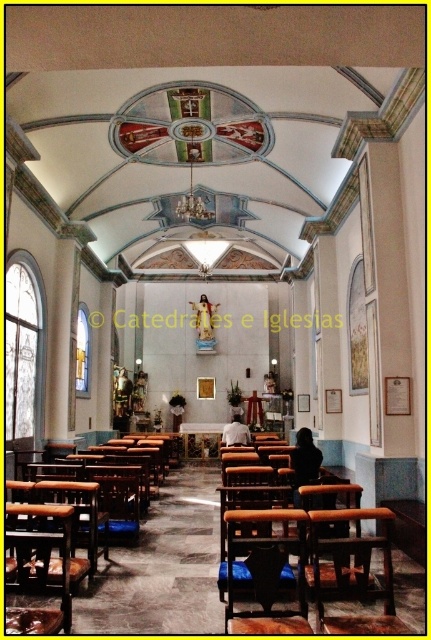
Question: Is wooden statue at center below white fabric shirt at center?

Choices:
 (A) no
 (B) yes

Answer: (A)

Question: Among these objects, which one is nearest to the camera?

Choices:
 (A) blue fabric cushion at center
 (B) wooden table at center
 (C) black fabric at center

Answer: (C)

Question: Does wooden polished chair at center appear on the left side of wooden statue at center?

Choices:
 (A) yes
 (B) no

Answer: (B)

Question: Is black fabric at center further to camera compared to white fabric shirt at center?

Choices:
 (A) yes
 (B) no

Answer: (B)

Question: Which point appears farthest from the camera in this image?

Choices:
 (A) (121, 369)
 (B) (299, 595)
 (C) (343, 512)
 (D) (224, 436)

Answer: (A)

Question: Which of these objects is positioned farthest from the wooden table at center?

Choices:
 (A) brown wooden chair at lower center
 (B) gold textured statue at center

Answer: (A)